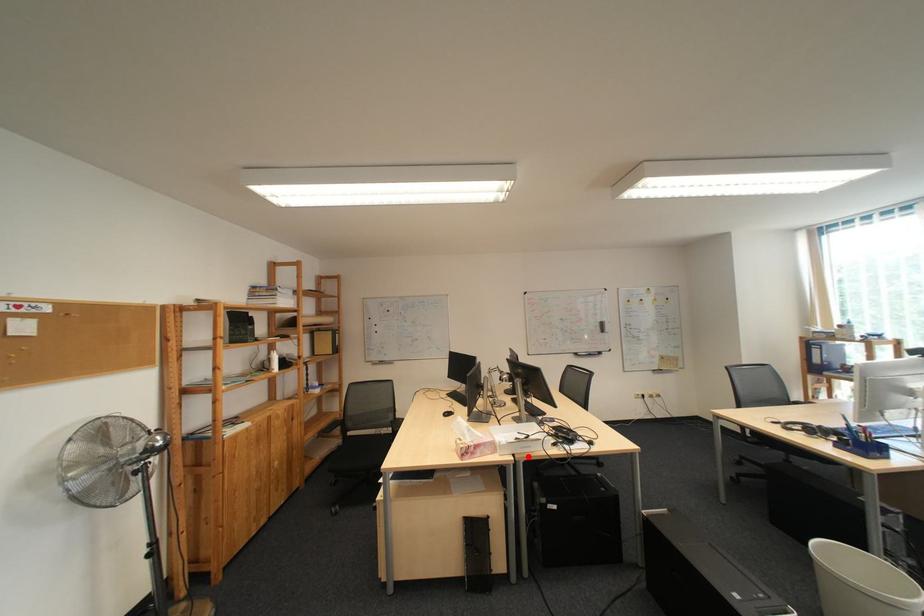
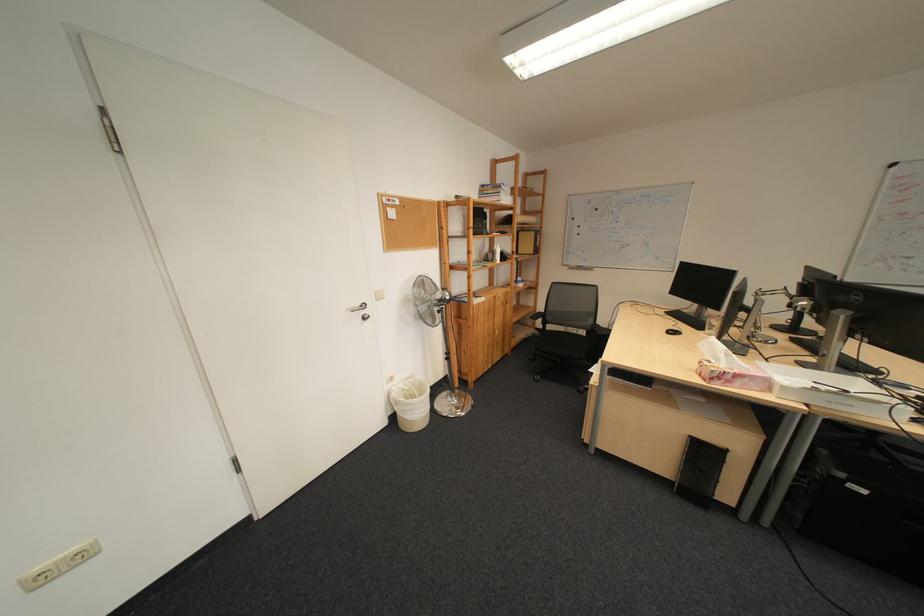
Find the pixel in the second image that matches the highlighted location in the first image.

(821, 407)